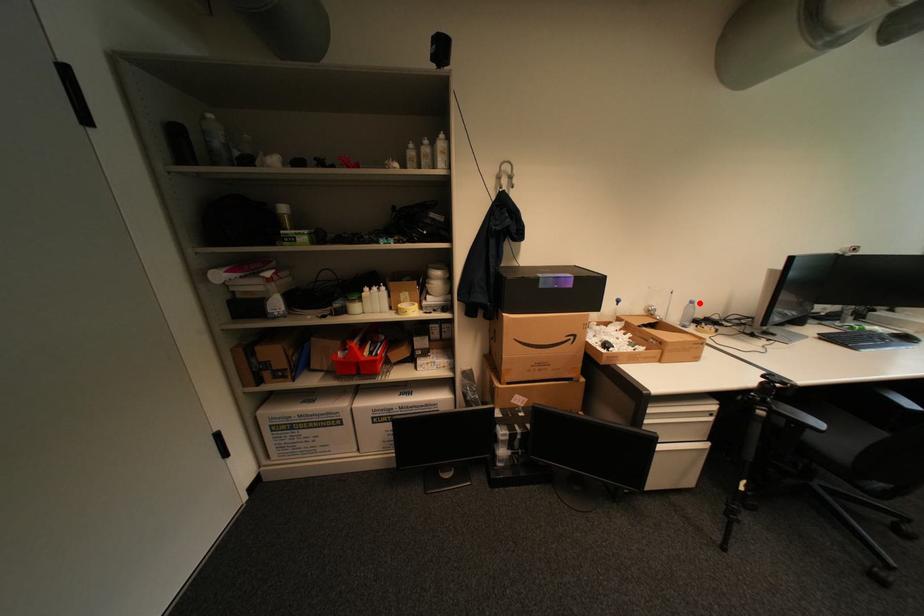
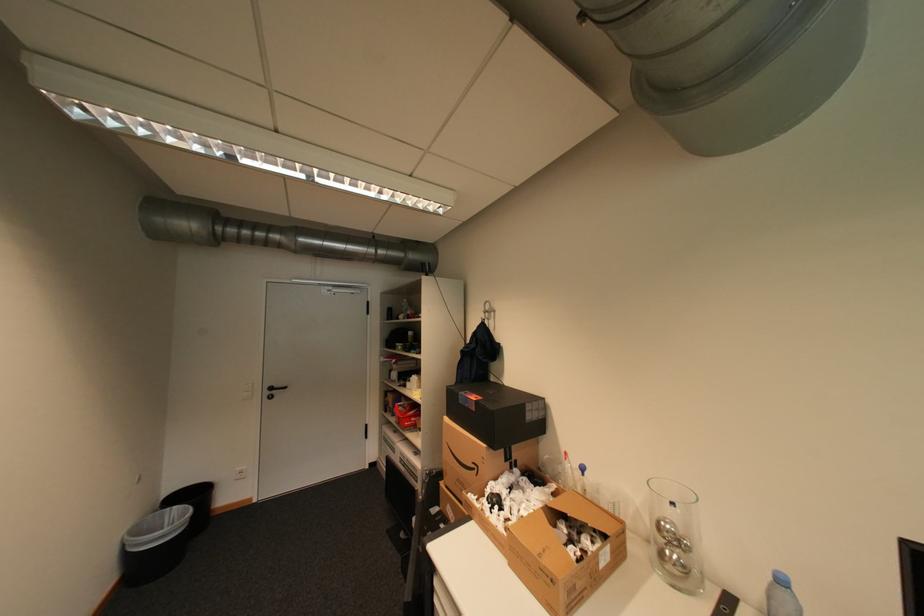
The point at the highlighted location is marked in the first image. Where is the corresponding point in the second image?

(791, 582)